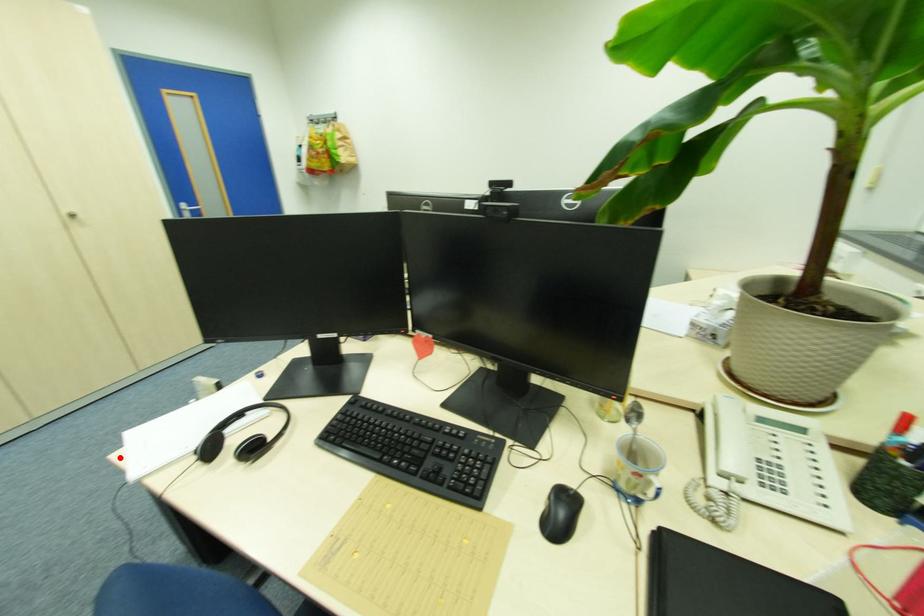
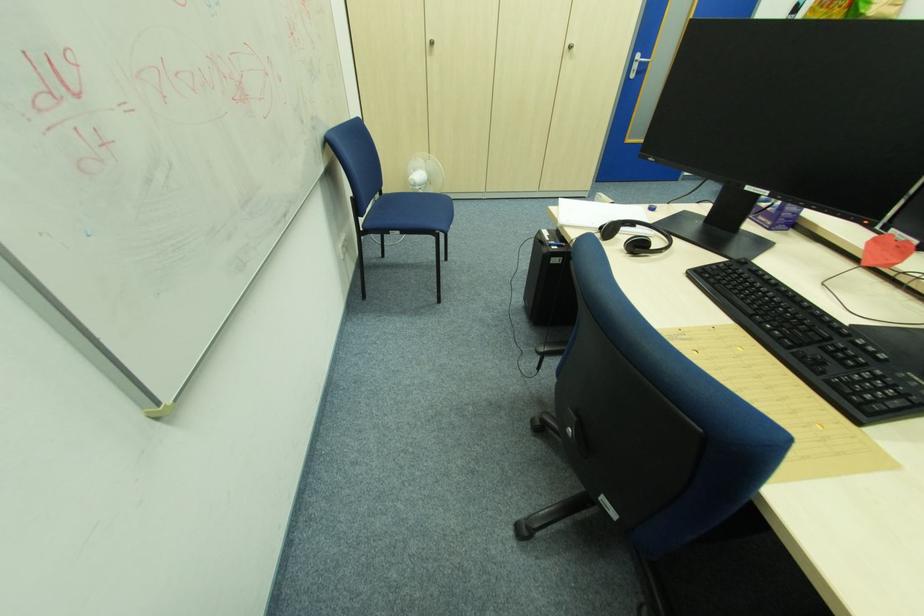
In the second image, find the point that corresponds to the highlighted location in the first image.

(556, 209)